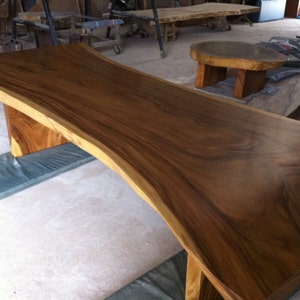
I want to click on close faces of tabletops, so click(x=140, y=19), click(x=202, y=56), click(x=94, y=152).